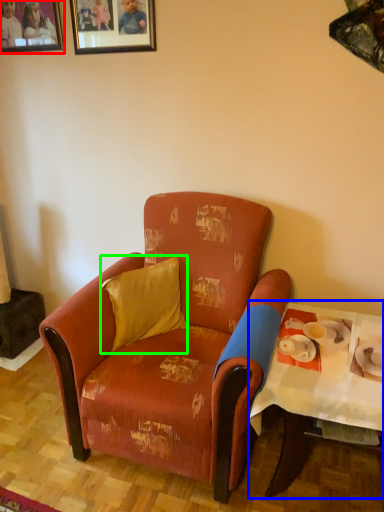
Question: Considering the real-world distances, which object is farthest from picture frame (highlighted by a red box)? table (highlighted by a blue box) or pillow (highlighted by a green box)?

Choices:
 (A) table
 (B) pillow

Answer: (A)